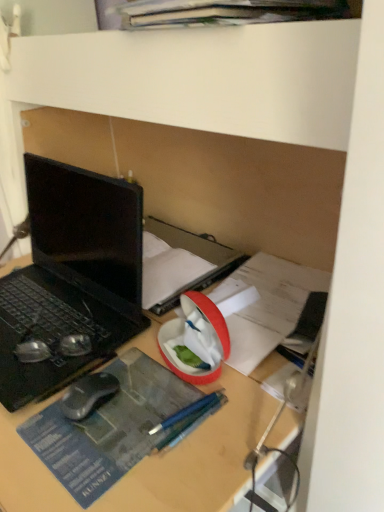
Locate an element on the screen. This screenshot has height=512, width=384. free space in front of black rubberized mouse at lower left is located at coordinates (89, 451).